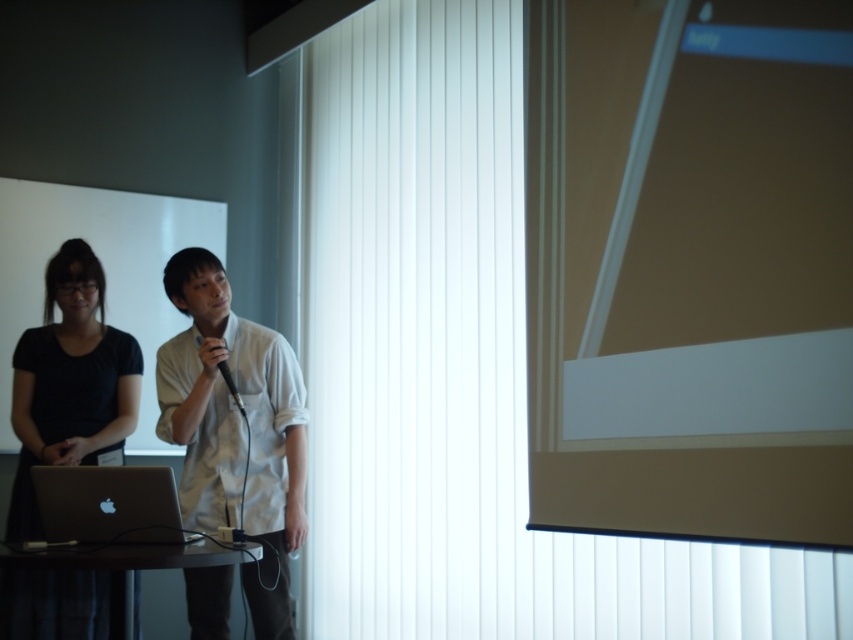
From the picture: You are organizing a presentation and need to place a projector remote on the table such that it is exactly 0.1 units to the right of the black matte laptop at lower left. Where should you place the projector remote on the table?

The projector remote should be placed at the coordinates calculated by adding 0.1 to the x value of the black matte laptop at lower left. Since the laptop is at point (x=70, y=381), the new coordinates would be (x=70, y=445).

You are organizing a presentation and need to ensure the white matte shirt at center and the silver metallic laptop at lower left are visible to the audience. Which object takes up more horizontal space in the scene?

The white matte shirt at center takes up more horizontal space because its width is larger than that of the silver metallic laptop at lower left.